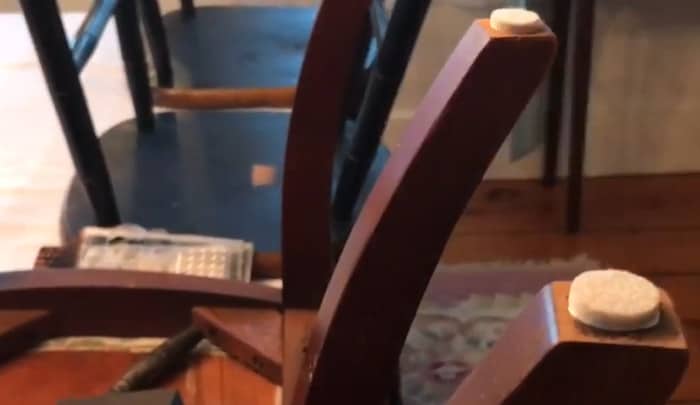
You are a GUI agent. You are given a task and a screenshot of the screen. Output one action in this format:
    pyautogui.click(x=<x>, y=<y>)
    Task: Click on the chair
    The width and height of the screenshot is (700, 405).
    Given the screenshot: What is the action you would take?
    pyautogui.click(x=217, y=393), pyautogui.click(x=217, y=175), pyautogui.click(x=246, y=54)